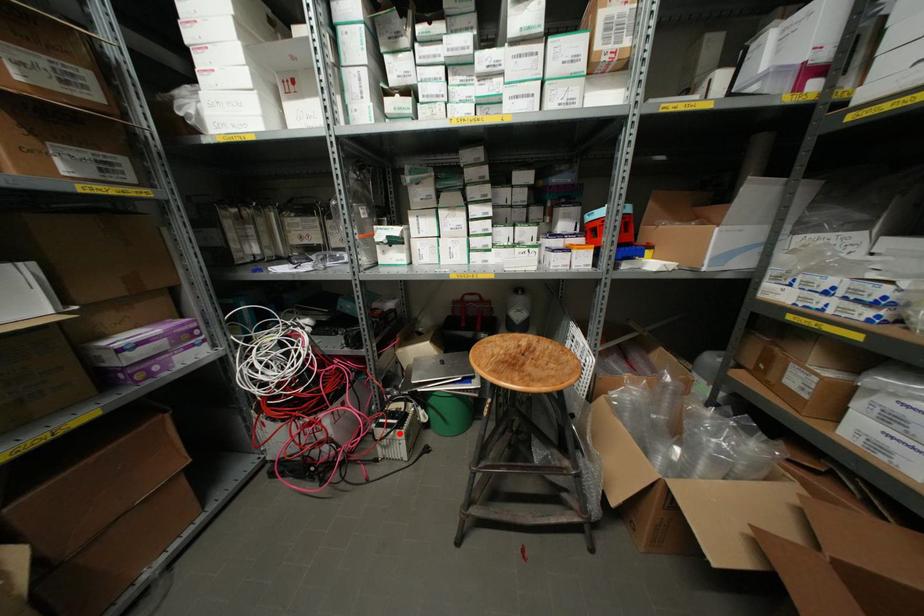
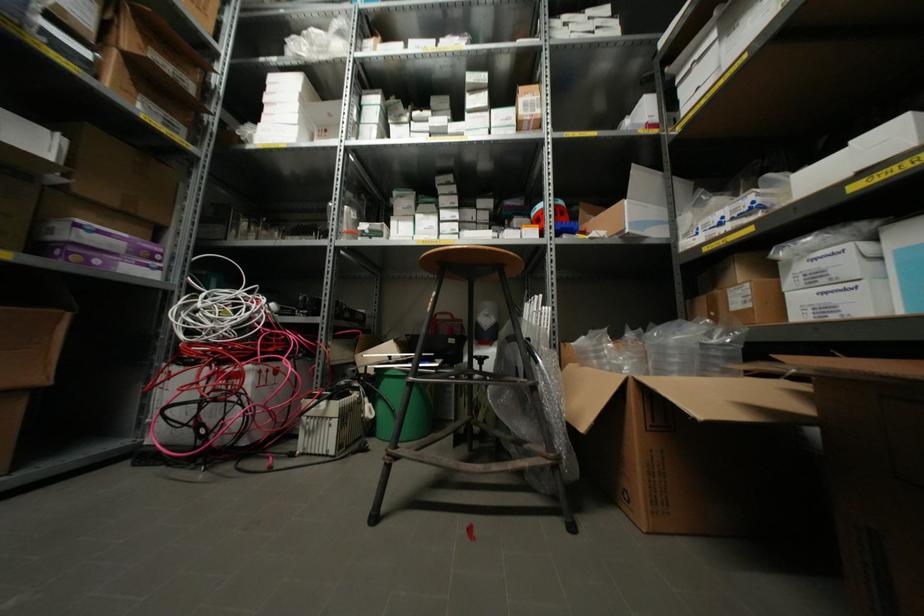
Question: I am providing you with two images of the same scene from different viewpoints. Given a red point in image1, look at the same physical point in image2. Is it:

Choices:
 (A) Closer to the viewpoint
 (B) Farther from the viewpoint

Answer: (A)